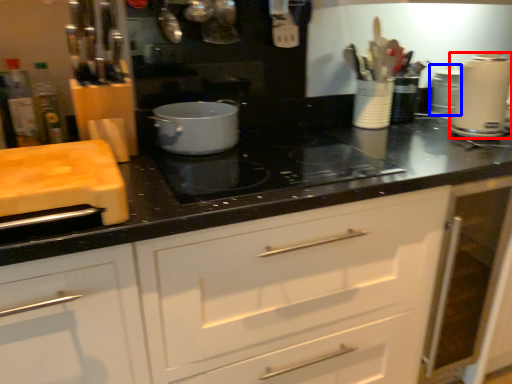
Question: Which object appears closest to the camera in this image, kitchen appliance (highlighted by a red box) or appliance (highlighted by a blue box)?

Choices:
 (A) kitchen appliance
 (B) appliance

Answer: (A)